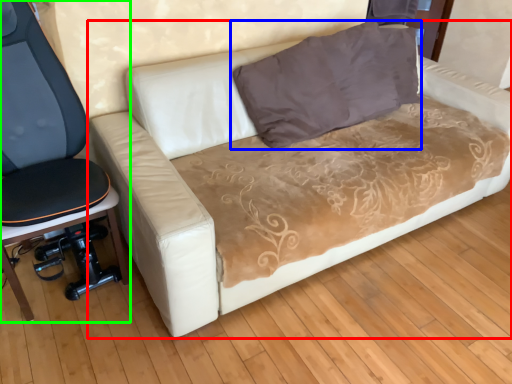
Question: Which object is the closest to the studio couch (highlighted by a red box)? Choose among these: pillow (highlighted by a blue box) or furniture (highlighted by a green box).

Choices:
 (A) pillow
 (B) furniture

Answer: (A)